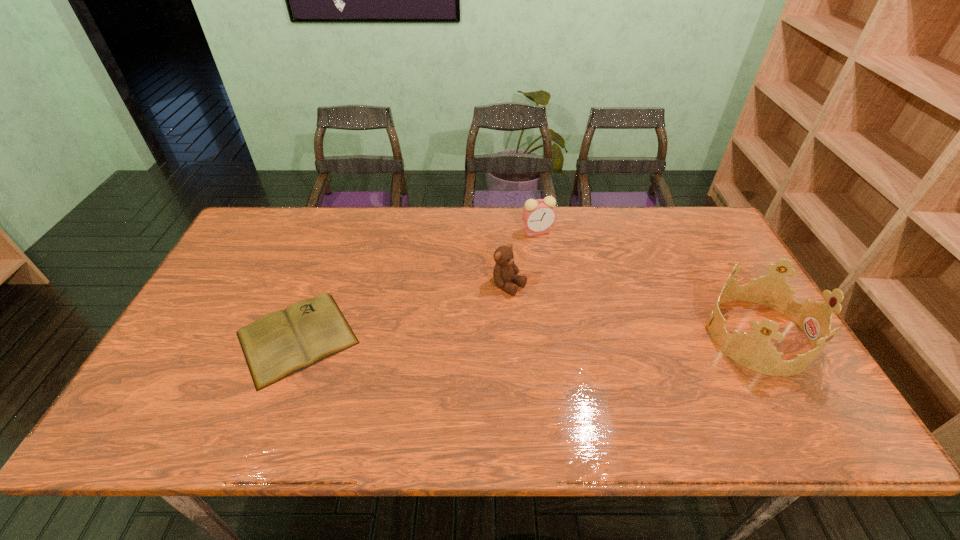
Identify the location of blank space that satisfies the following two spatial constraints: 1. on the back side of the farthest object; 2. on the left side of the shortest object. (337, 231).

Locate an element on the screen. This screenshot has height=540, width=960. free location that satisfies the following two spatial constraints: 1. on the front side of the rightmost object; 2. on the front-facing side of the third object from right to left is located at coordinates (514, 335).